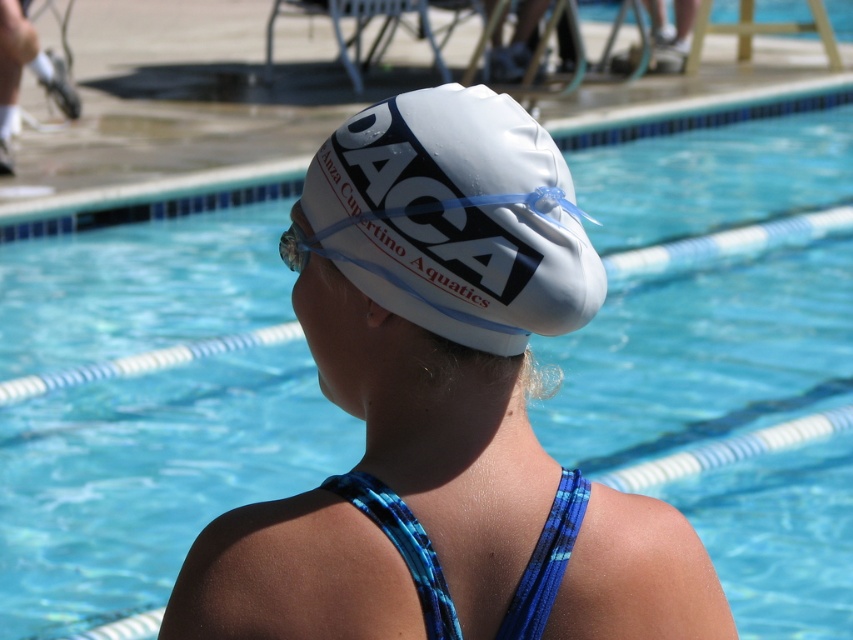
Question: Is white matte swim cap at center thinner than clear plastic goggles at center?

Choices:
 (A) no
 (B) yes

Answer: (A)

Question: Does white matte swim cap at center have a larger size compared to clear plastic goggles at center?

Choices:
 (A) yes
 (B) no

Answer: (A)

Question: Which point is farther to the camera?

Choices:
 (A) clear plastic goggles at center
 (B) white matte swim cap at center

Answer: (A)

Question: Estimate the real-world distances between objects in this image. Which object is farther from the blue woven strap at back?

Choices:
 (A) clear plastic goggles at center
 (B) white matte swim cap at center

Answer: (A)

Question: Can you confirm if white matte swim cap at center is positioned to the right of blue woven strap at back?

Choices:
 (A) yes
 (B) no

Answer: (A)

Question: Which point is farther from the camera taking this photo?

Choices:
 (A) (292, 241)
 (B) (428, 636)

Answer: (A)